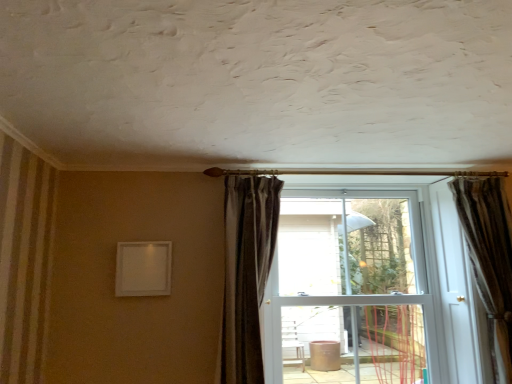
Question: Is brown textured curtain at right, the 1th curtain viewed from the right, at the back of white glossy door at center?

Choices:
 (A) no
 (B) yes

Answer: (A)

Question: Can you confirm if white glossy door at center is shorter than brown textured curtain at right, positioned as the 2th curtain in left-to-right order?

Choices:
 (A) yes
 (B) no

Answer: (B)

Question: Considering the relative sizes of white glossy door at center and brown textured curtain at right, the 1th curtain viewed from the right, in the image provided, is white glossy door at center bigger than brown textured curtain at right, the 1th curtain viewed from the right,?

Choices:
 (A) no
 (B) yes

Answer: (B)

Question: Is white glossy door at center directly adjacent to brown textured curtain at right, positioned as the 2th curtain in left-to-right order?

Choices:
 (A) no
 (B) yes

Answer: (A)

Question: Is white glossy door at center not near brown textured curtain at right, positioned as the 2th curtain in left-to-right order?

Choices:
 (A) no
 (B) yes

Answer: (A)

Question: Considering the positions of dark brown velvet curtain at center, the second curtain when ordered from right to left, and brown textured curtain at right, positioned as the 2th curtain in left-to-right order, in the image, is dark brown velvet curtain at center, the second curtain when ordered from right to left, taller or shorter than brown textured curtain at right, positioned as the 2th curtain in left-to-right order,?

Choices:
 (A) short
 (B) tall

Answer: (A)

Question: Choose the correct answer: Is dark brown velvet curtain at center, arranged as the first curtain when viewed from the left, inside brown textured curtain at right, positioned as the 2th curtain in left-to-right order, or outside it?

Choices:
 (A) outside
 (B) inside

Answer: (A)

Question: Is point (266, 220) closer or farther from the camera than point (482, 195)?

Choices:
 (A) closer
 (B) farther

Answer: (A)

Question: Is dark brown velvet curtain at center, the second curtain when ordered from right to left, wider or thinner than brown textured curtain at right, positioned as the 2th curtain in left-to-right order?

Choices:
 (A) wide
 (B) thin

Answer: (A)

Question: Is brown textured curtain at right, the 1th curtain viewed from the right, bigger or smaller than dark brown velvet curtain at center, the second curtain when ordered from right to left?

Choices:
 (A) big
 (B) small

Answer: (B)

Question: Is point (507, 226) positioned closer to the camera than point (230, 231)?

Choices:
 (A) farther
 (B) closer

Answer: (A)

Question: From the image's perspective, relative to dark brown velvet curtain at center, arranged as the first curtain when viewed from the left, is brown textured curtain at right, positioned as the 2th curtain in left-to-right order, above or below?

Choices:
 (A) above
 (B) below

Answer: (B)

Question: Considering the positions of brown textured curtain at right, positioned as the 2th curtain in left-to-right order, and dark brown velvet curtain at center, the second curtain when ordered from right to left, in the image, is brown textured curtain at right, positioned as the 2th curtain in left-to-right order, wider or thinner than dark brown velvet curtain at center, the second curtain when ordered from right to left,?

Choices:
 (A) thin
 (B) wide

Answer: (A)

Question: Is white glossy door at center in front of or behind brown textured curtain at right, the 1th curtain viewed from the right, in the image?

Choices:
 (A) behind
 (B) front

Answer: (A)

Question: From a real-world perspective, is white glossy door at center positioned above or below brown textured curtain at right, positioned as the 2th curtain in left-to-right order?

Choices:
 (A) below
 (B) above

Answer: (A)